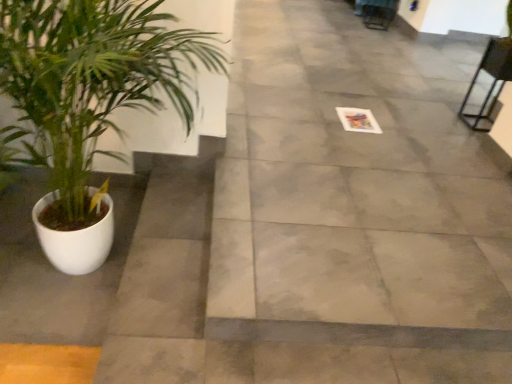
Question: Is metallic black chair at upper right next to gray concrete pavement at center and touching it?

Choices:
 (A) no
 (B) yes

Answer: (A)

Question: Does metallic black chair at upper right lie in front of gray concrete pavement at center?

Choices:
 (A) no
 (B) yes

Answer: (A)

Question: Is metallic black chair at upper right to the right of gray concrete pavement at center from the viewer's perspective?

Choices:
 (A) no
 (B) yes

Answer: (B)

Question: Is metallic black chair at upper right not inside gray concrete pavement at center?

Choices:
 (A) no
 (B) yes

Answer: (B)

Question: Is gray concrete pavement at center at the back of metallic black chair at upper right?

Choices:
 (A) yes
 (B) no

Answer: (B)

Question: Does metallic black chair at upper right have a greater height compared to gray concrete pavement at center?

Choices:
 (A) yes
 (B) no

Answer: (A)

Question: Considering the relative positions of green leafy plant at left and gray concrete pavement at center in the image provided, is green leafy plant at left behind gray concrete pavement at center?

Choices:
 (A) no
 (B) yes

Answer: (A)

Question: Is green leafy plant at left turned away from gray concrete pavement at center?

Choices:
 (A) no
 (B) yes

Answer: (A)

Question: Is green leafy plant at left bigger than gray concrete pavement at center?

Choices:
 (A) yes
 (B) no

Answer: (A)

Question: Is green leafy plant at left taller than gray concrete pavement at center?

Choices:
 (A) yes
 (B) no

Answer: (A)

Question: From a real-world perspective, is green leafy plant at left on top of gray concrete pavement at center?

Choices:
 (A) yes
 (B) no

Answer: (A)

Question: Can you confirm if green leafy plant at left is wider than gray concrete pavement at center?

Choices:
 (A) yes
 (B) no

Answer: (B)

Question: From the image's perspective, does gray concrete pavement at center appear lower than metallic black chair at upper right?

Choices:
 (A) no
 (B) yes

Answer: (A)